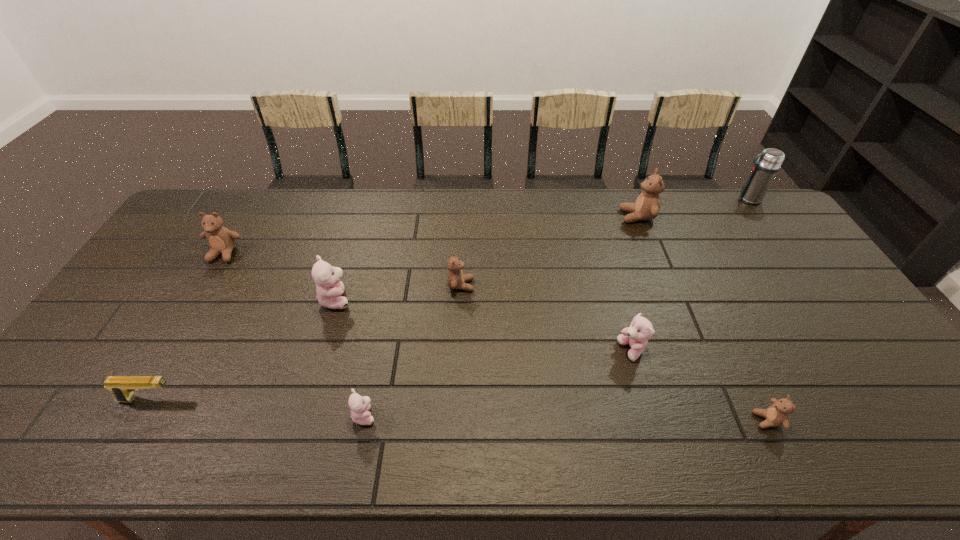
What are the coordinates of `the rightmost object` in the screenshot? It's located at (764, 171).

This screenshot has height=540, width=960. Find the location of `the tallest teddy bear`. the tallest teddy bear is located at coordinates (647, 206).

Locate an element on the screen. the biggest brown teddy bear is located at coordinates (647, 206).

The width and height of the screenshot is (960, 540). In order to click on the second teddy bear from left to right in this screenshot , I will do `click(329, 288)`.

Identify the location of the farthest pink teddy bear. (329, 288).

Where is `the sixth nearest teddy bear`? The image size is (960, 540). the sixth nearest teddy bear is located at coordinates (221, 240).

The width and height of the screenshot is (960, 540). Find the location of `the leftmost teddy bear`. the leftmost teddy bear is located at coordinates (221, 240).

Where is `the fourth teddy bear from right to left`? The height and width of the screenshot is (540, 960). the fourth teddy bear from right to left is located at coordinates (456, 279).

This screenshot has height=540, width=960. I want to click on the second brown teddy bear from left to right, so click(456, 279).

Find the location of `the third teddy bear from right to left`. the third teddy bear from right to left is located at coordinates (641, 330).